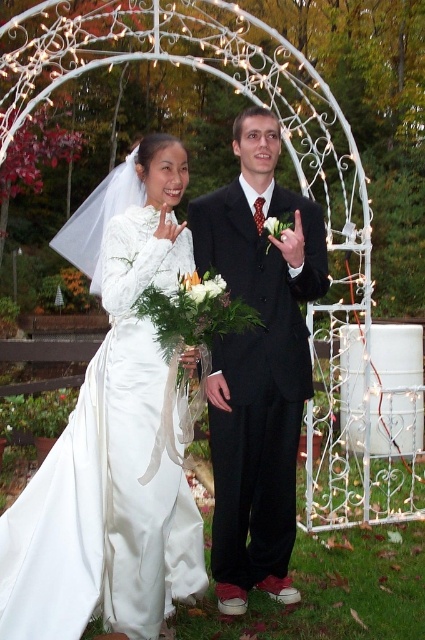
Between white satin dress at left and matte black suit at center, which one has more height?

matte black suit at center is taller.

The width and height of the screenshot is (425, 640). What do you see at coordinates (107, 477) in the screenshot? I see `white satin dress at left` at bounding box center [107, 477].

What are the coordinates of `white satin dress at left` in the screenshot? It's located at (107, 477).

I want to click on white satin dress at left, so click(107, 477).